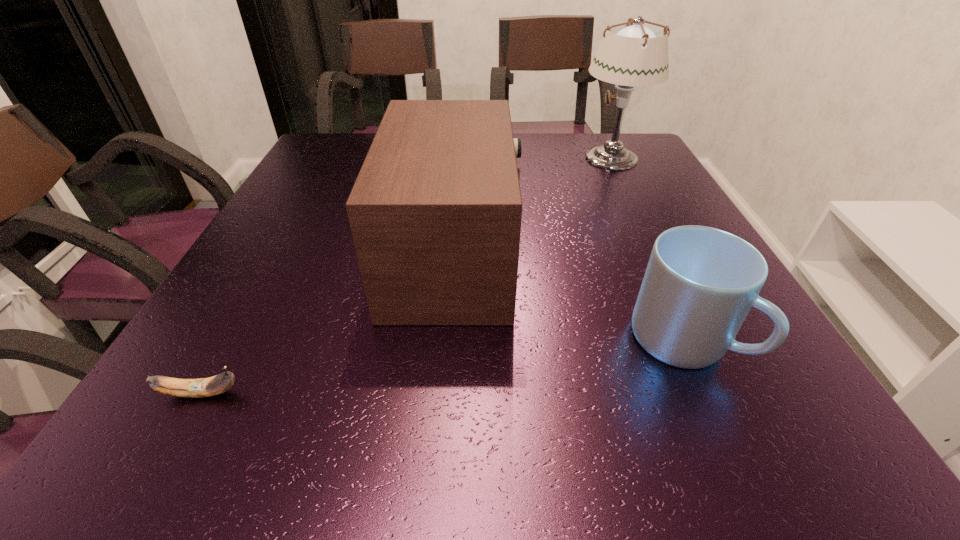
Locate an element on the screen. The height and width of the screenshot is (540, 960). vacant space that satisfies the following two spatial constraints: 1. on the front-facing side of the second object from left to right; 2. on the right side of the mug is located at coordinates pyautogui.click(x=450, y=341).